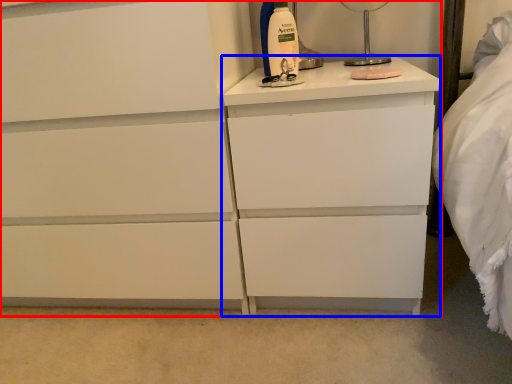
Question: Which object appears closest to the camera in this image, chest of drawers (highlighted by a red box) or nightstand (highlighted by a blue box)?

Choices:
 (A) chest of drawers
 (B) nightstand

Answer: (A)